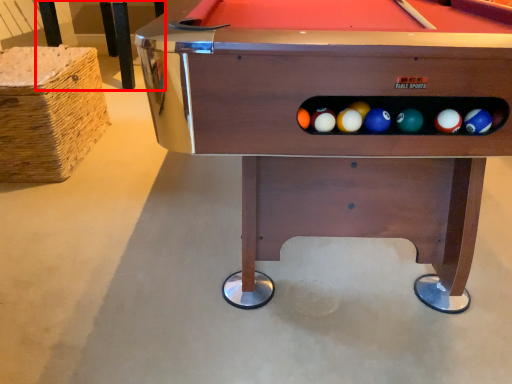
Question: Considering the relative positions of table (annotated by the red box) and billiard table in the image provided, where is table (annotated by the red box) located with respect to the staircase?

Choices:
 (A) right
 (B) left

Answer: (B)